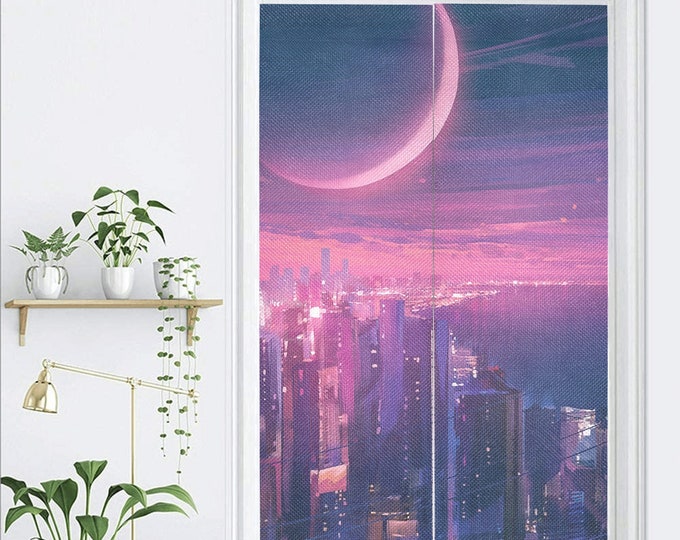
Where is `white painted walls`? The height and width of the screenshot is (540, 680). white painted walls is located at coordinates (113, 66), (666, 79).